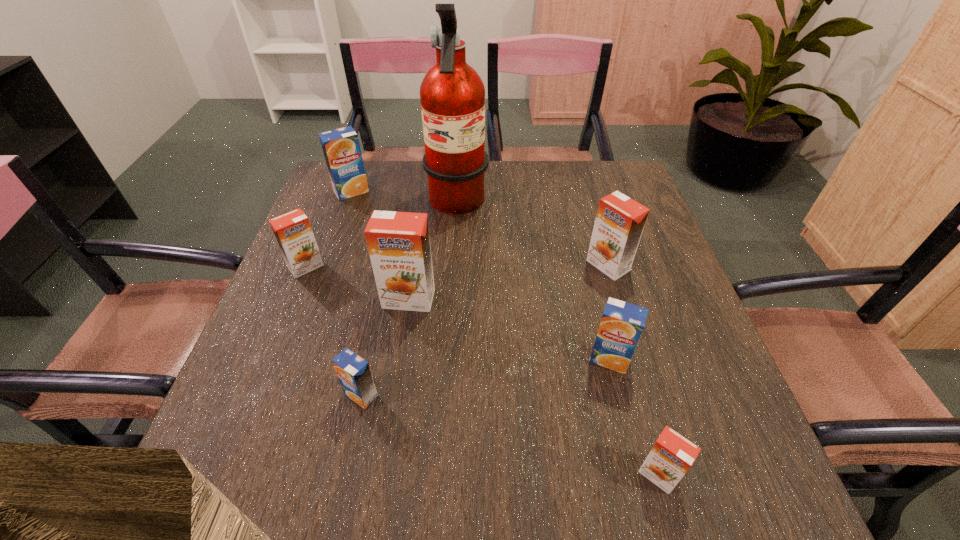
Find the location of a particular element. This screenshot has width=960, height=540. blank space at the far left corner of the desktop is located at coordinates (371, 174).

Find the location of a particular element. empty location between the rightmost blue orange_juice and the fire extinguisher is located at coordinates (533, 282).

The image size is (960, 540). I want to click on free space that is in between the leftmost blue orange_juice and the tallest object, so click(x=404, y=198).

You are a GUI agent. You are given a task and a screenshot of the screen. Output one action in this format:
    pyautogui.click(x=<x>, y=<y>)
    Task: Click on the vacant area that lies between the rightmost blue orange_juice and the leftmost blue orange_juice
    The image size is (960, 540).
    Given the screenshot: What is the action you would take?
    pyautogui.click(x=480, y=275)

This screenshot has width=960, height=540. Find the location of `vacant area that lies between the leftmost blue orange_juice and the smallest blue orange_juice`. vacant area that lies between the leftmost blue orange_juice and the smallest blue orange_juice is located at coordinates (356, 293).

Where is `free point between the second blue orange_juice from left to right and the seventh shortest object`? free point between the second blue orange_juice from left to right and the seventh shortest object is located at coordinates (385, 347).

You are a GUI agent. You are given a task and a screenshot of the screen. Output one action in this format:
    pyautogui.click(x=<x>, y=<y>)
    Task: Click on the vacant space that's between the rightmost blue orange_juice and the tallest object
    
    Given the screenshot: What is the action you would take?
    pyautogui.click(x=533, y=282)

Where is `the closest object to the leftmost orange orange juice`? the closest object to the leftmost orange orange juice is located at coordinates (398, 243).

Choose which object is the fourth nearest neighbor to the second biggest orange orange juice. Please provide its 2D coordinates. Your answer should be formatted as a tuple, i.e. [(x, y)], where the tuple contains the x and y coordinates of a point satisfying the conditions above.

[(671, 457)]

Choose which orange juice is the fourth nearest neighbor to the second biggest orange orange juice. Please provide its 2D coordinates. Your answer should be formatted as a tuple, i.e. [(x, y)], where the tuple contains the x and y coordinates of a point satisfying the conditions above.

[(354, 374)]